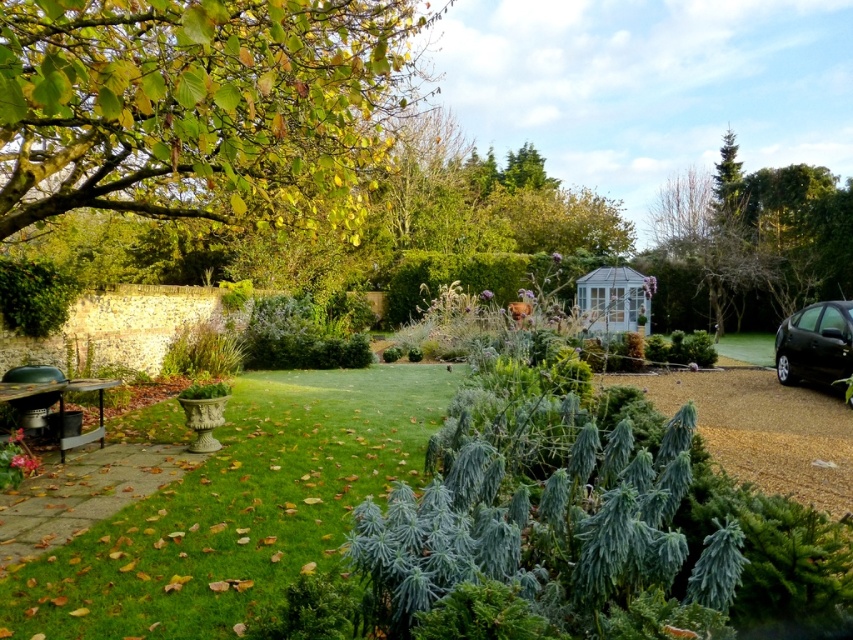
You are a gardener trying to park your 5.5 meter long black metallic car at right in the garden. The green grass at lower left is where you want to place a new flower bed. Is there enough space between them to park the car without overlapping the flower bed area?

The distance between the green grass at lower left and the black metallic car at right is 8.82 meters, which is greater than the car length of 5.5 meters. Therefore, there is sufficient space to park the car without overlapping the flower bed area.

You are standing in the garden and want to take a photo of the green leafy tree at upper left without any green grass at lower left in the frame. Which direction should you move to achieve this?

Move upward to avoid the green grass at lower left in the frame since the green leafy tree at upper left is above the green grass at lower left.

You are a gardener planning to trim the green leafy tree at upper left so it doesn not block the black metallic car at right. Which part of the tree should you trim?

The green leafy tree at upper left is positioned over the black metallic car at right, so you should trim the lower branches of the green leafy tree at upper left to prevent it from blocking the black metallic car at right.